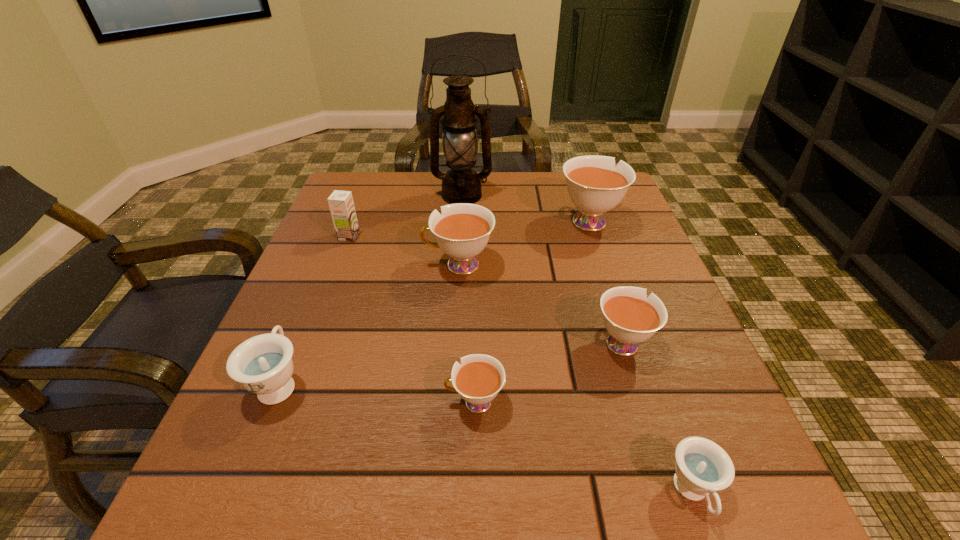
This screenshot has width=960, height=540. I want to click on object present at the near edge, so click(x=702, y=467).

Locate an element on the screen. This screenshot has width=960, height=540. chocolate milk at the left edge is located at coordinates (341, 204).

Where is `teacup situated at the left edge`? teacup situated at the left edge is located at coordinates (263, 364).

Identify the location of object present at the far right corner. This screenshot has width=960, height=540. (594, 185).

At what (x,y) coordinates should I click in order to perform the action: click on object situated at the near right corner. Please return your answer as a coordinate pair (x, y). Looking at the image, I should click on (702, 467).

In the image, there is a desktop. At what (x,y) coordinates should I click in order to perform the action: click on vacant region at the far edge. Please return your answer as a coordinate pair (x, y). The width and height of the screenshot is (960, 540). Looking at the image, I should click on (542, 204).

Identify the location of vacant space at the near edge. The height and width of the screenshot is (540, 960). pyautogui.click(x=335, y=482).

In the image, there is a desktop. Find the location of `free space at the left edge`. free space at the left edge is located at coordinates (325, 259).

Find the location of a particular element. The image size is (960, 540). free space at the right edge of the desktop is located at coordinates (650, 352).

The image size is (960, 540). Identify the location of vacant space at the far left corner of the desktop. (376, 218).